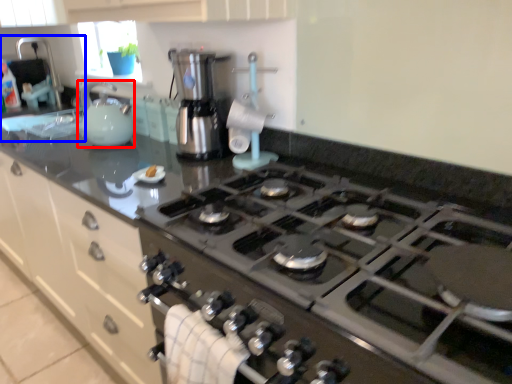
Question: Which of the following is the farthest to the observer, kitchen appliance (highlighted by a red box) or sink (highlighted by a blue box)?

Choices:
 (A) kitchen appliance
 (B) sink

Answer: (B)